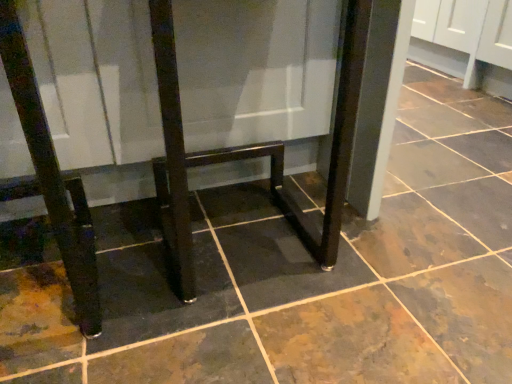
This screenshot has height=384, width=512. Describe the element at coordinates (251, 152) in the screenshot. I see `glossy dark wood table at center, which appears as the first furniture when viewed from the right` at that location.

At what (x,y) coordinates should I click in order to perform the action: click on glossy dark wood table at center, the 2th furniture from the left. Please return your answer as a coordinate pair (x, y). Looking at the image, I should click on (251, 152).

What is the approximate height of glossy dark wood table at center, the 2th furniture from the left?

It is 21.76 inches.

Measure the distance between point (154, 33) and camera.

They are 24.53 inches apart.

The image size is (512, 384). What do you see at coordinates (251, 150) in the screenshot?
I see `glossy dark wood table at center, the 2th furniture when ordered from right to left` at bounding box center [251, 150].

Where is `glossy dark wood table at center, which is counted as the 1th furniture, starting from the left`? glossy dark wood table at center, which is counted as the 1th furniture, starting from the left is located at coordinates (251, 150).

Locate an element on the screen. glossy dark wood table at center, which appears as the first furniture when viewed from the right is located at coordinates (251, 152).

Looking at this image, is glossy dark wood table at center, which appears as the first furniture when viewed from the right, to the right of glossy dark wood table at center, which is counted as the 1th furniture, starting from the left, from the viewer's perspective?

Yes.

Considering the positions of objects glossy dark wood table at center, the 2th furniture from the left, and glossy dark wood table at center, which is counted as the 1th furniture, starting from the left, in the image provided, who is in front, glossy dark wood table at center, the 2th furniture from the left, or glossy dark wood table at center, which is counted as the 1th furniture, starting from the left,?

glossy dark wood table at center, which is counted as the 1th furniture, starting from the left, is more forward.

Which point is more distant from viewer, (343, 190) or (66, 230)?

The point (343, 190) is behind.

From the image's perspective, is glossy dark wood table at center, the 2th furniture from the left, beneath glossy dark wood table at center, which is counted as the 1th furniture, starting from the left?

Indeed, from the image's perspective, glossy dark wood table at center, the 2th furniture from the left, is shown beneath glossy dark wood table at center, which is counted as the 1th furniture, starting from the left.

From a real-world perspective, is glossy dark wood table at center, which appears as the first furniture when viewed from the right, under glossy dark wood table at center, the 2th furniture when ordered from right to left?

No, from a real-world perspective, glossy dark wood table at center, which appears as the first furniture when viewed from the right, is not beneath glossy dark wood table at center, the 2th furniture when ordered from right to left.

Which object is wider, glossy dark wood table at center, the 2th furniture from the left, or glossy dark wood table at center, which is counted as the 1th furniture, starting from the left?

With larger width is glossy dark wood table at center, which is counted as the 1th furniture, starting from the left.

From their relative heights in the image, would you say glossy dark wood table at center, which appears as the first furniture when viewed from the right, is taller or shorter than glossy dark wood table at center, which is counted as the 1th furniture, starting from the left?

glossy dark wood table at center, which appears as the first furniture when viewed from the right, is shorter than glossy dark wood table at center, which is counted as the 1th furniture, starting from the left.

In the scene shown: Can you confirm if glossy dark wood table at center, the 2th furniture from the left, is bigger than glossy dark wood table at center, the 2th furniture when ordered from right to left?

No.

Would you say glossy dark wood table at center, which appears as the first furniture when viewed from the right, is inside or outside glossy dark wood table at center, which is counted as the 1th furniture, starting from the left?

glossy dark wood table at center, which appears as the first furniture when viewed from the right, is spatially positioned inside glossy dark wood table at center, which is counted as the 1th furniture, starting from the left.

Would you say glossy dark wood table at center, which appears as the first furniture when viewed from the right, is a long distance from glossy dark wood table at center, the 2th furniture when ordered from right to left?

No, there isn't a large distance between glossy dark wood table at center, which appears as the first furniture when viewed from the right, and glossy dark wood table at center, the 2th furniture when ordered from right to left.

Could you tell me if glossy dark wood table at center, the 2th furniture from the left, is turned towards glossy dark wood table at center, which is counted as the 1th furniture, starting from the left?

Yes, glossy dark wood table at center, the 2th furniture from the left, faces towards glossy dark wood table at center, which is counted as the 1th furniture, starting from the left.

How much distance is there between glossy dark wood table at center, the 2th furniture from the left, and glossy dark wood table at center, the 2th furniture when ordered from right to left?

glossy dark wood table at center, the 2th furniture from the left, and glossy dark wood table at center, the 2th furniture when ordered from right to left, are 1.50 inches apart from each other.

In order to click on furniture above the glossy dark wood table at center, the 2th furniture from the left (from the image's perspective) in this screenshot , I will do `click(251, 150)`.

Visually, is glossy dark wood table at center, which is counted as the 1th furniture, starting from the left, positioned to the left or to the right of glossy dark wood table at center, which appears as the first furniture when viewed from the right?

Based on their positions, glossy dark wood table at center, which is counted as the 1th furniture, starting from the left, is located to the left of glossy dark wood table at center, which appears as the first furniture when viewed from the right.

Which object is further away from the camera taking this photo, glossy dark wood table at center, which is counted as the 1th furniture, starting from the left, or glossy dark wood table at center, the 2th furniture from the left?

glossy dark wood table at center, the 2th furniture from the left, is further away from the camera.

Does point (60, 187) come closer to viewer compared to point (331, 242)?

Yes, point (60, 187) is closer to viewer.

From the image's perspective, is glossy dark wood table at center, the 2th furniture when ordered from right to left, above glossy dark wood table at center, which appears as the first furniture when viewed from the right?

Yes.

From a real-world perspective, between glossy dark wood table at center, which is counted as the 1th furniture, starting from the left, and glossy dark wood table at center, the 2th furniture from the left, who is vertically higher?

In real-world perspective, glossy dark wood table at center, the 2th furniture from the left, is above.

Considering the sizes of objects glossy dark wood table at center, the 2th furniture when ordered from right to left, and glossy dark wood table at center, the 2th furniture from the left, in the image provided, who is wider, glossy dark wood table at center, the 2th furniture when ordered from right to left, or glossy dark wood table at center, the 2th furniture from the left,?

Wider between the two is glossy dark wood table at center, the 2th furniture when ordered from right to left.

From their relative heights in the image, would you say glossy dark wood table at center, which is counted as the 1th furniture, starting from the left, is taller or shorter than glossy dark wood table at center, which appears as the first furniture when viewed from the right?

Considering their sizes, glossy dark wood table at center, which is counted as the 1th furniture, starting from the left, has more height than glossy dark wood table at center, which appears as the first furniture when viewed from the right.

Based on their sizes in the image, would you say glossy dark wood table at center, the 2th furniture when ordered from right to left, is bigger or smaller than glossy dark wood table at center, the 2th furniture from the left?

In the image, glossy dark wood table at center, the 2th furniture when ordered from right to left, appears to be larger than glossy dark wood table at center, the 2th furniture from the left.

Is glossy dark wood table at center, the 2th furniture when ordered from right to left, inside the boundaries of glossy dark wood table at center, the 2th furniture from the left, or outside?

The correct answer is: outside.

Does glossy dark wood table at center, the 2th furniture when ordered from right to left, touch glossy dark wood table at center, the 2th furniture from the left?

Yes, glossy dark wood table at center, the 2th furniture when ordered from right to left, is next to glossy dark wood table at center, the 2th furniture from the left.

Is glossy dark wood table at center, which is counted as the 1th furniture, starting from the left, facing away from glossy dark wood table at center, the 2th furniture from the left?

No, glossy dark wood table at center, which is counted as the 1th furniture, starting from the left,'s orientation is not away from glossy dark wood table at center, the 2th furniture from the left.

How different are the orientations of glossy dark wood table at center, the 2th furniture when ordered from right to left, and glossy dark wood table at center, which appears as the first furniture when viewed from the right, in degrees?

The angular difference between glossy dark wood table at center, the 2th furniture when ordered from right to left, and glossy dark wood table at center, which appears as the first furniture when viewed from the right, is 90.6 degrees.

Identify the location of furniture lying below the glossy dark wood table at center, the 2th furniture when ordered from right to left (from the image's perspective). (251, 152).

Locate an element on the screen. This screenshot has width=512, height=384. furniture that appears behind the glossy dark wood table at center, which is counted as the 1th furniture, starting from the left is located at coordinates (251, 152).

Locate an element on the screen. The height and width of the screenshot is (384, 512). furniture below the glossy dark wood table at center, which is counted as the 1th furniture, starting from the left (from the image's perspective) is located at coordinates (x=251, y=152).